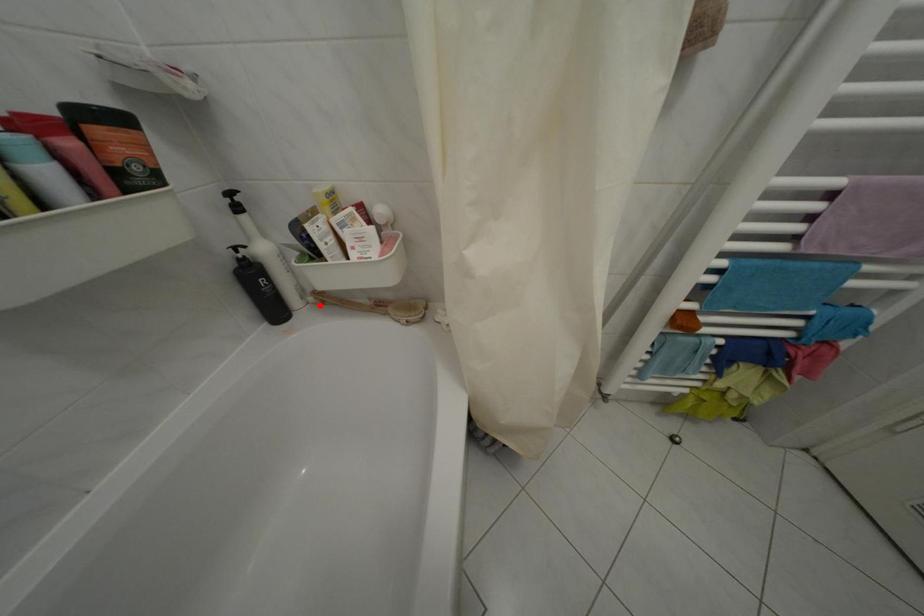
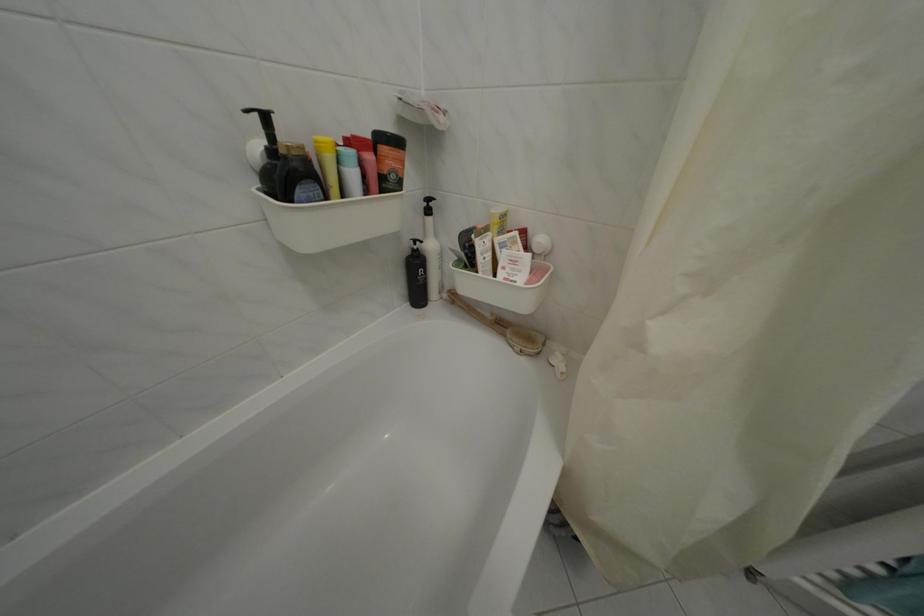
Find the pixel in the second image that matches the highlighted location in the first image.

(454, 302)